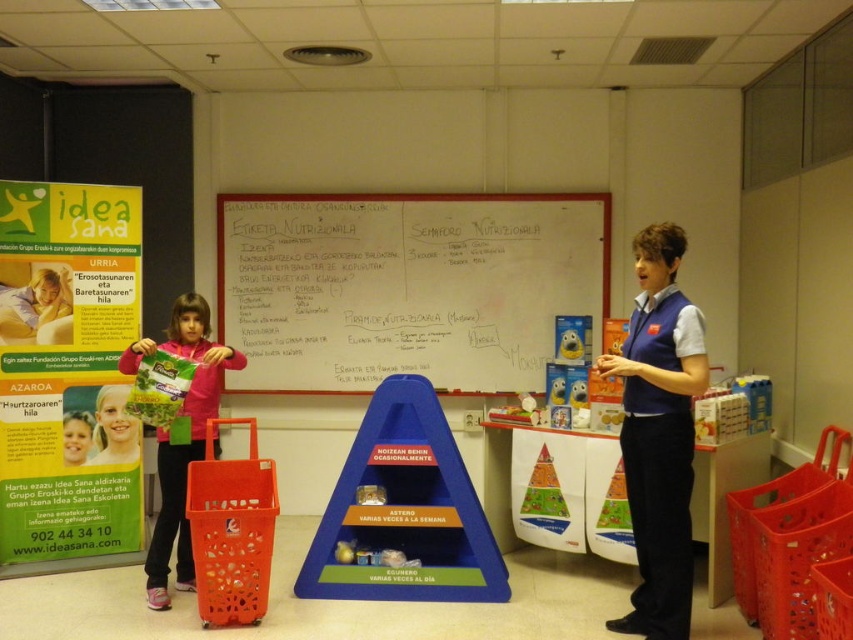
You are organizing a nutrition workshop and need to set up the space. You have an orange plastic shopping cart at lower left and a matte pink jacket at left. From the front of the room, which object is closer to you?

The orange plastic shopping cart at lower left is closer because it is in front of the matte pink jacket at left.